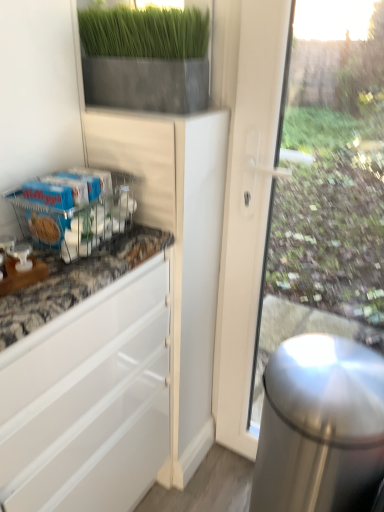
Question: Does metallic wire rack at lower left appear on the right side of polished stainless steel trash can at right?

Choices:
 (A) yes
 (B) no

Answer: (B)

Question: Could you tell me if metallic wire rack at lower left is facing polished stainless steel trash can at right?

Choices:
 (A) no
 (B) yes

Answer: (A)

Question: Is polished stainless steel trash can at right a part of metallic wire rack at lower left?

Choices:
 (A) yes
 (B) no

Answer: (B)

Question: Is metallic wire rack at lower left at the left side of polished stainless steel trash can at right?

Choices:
 (A) yes
 (B) no

Answer: (A)

Question: From the image's perspective, does metallic wire rack at lower left appear higher than polished stainless steel trash can at right?

Choices:
 (A) no
 (B) yes

Answer: (B)

Question: Is metallic wire rack at lower left bigger or smaller than matte gray planter at upper center?

Choices:
 (A) big
 (B) small

Answer: (B)

Question: Is point coord(49,247) positioned closer to the camera than point coord(109,34)?

Choices:
 (A) closer
 (B) farther

Answer: (A)

Question: From the image's perspective, is metallic wire rack at lower left located above or below matte gray planter at upper center?

Choices:
 (A) below
 (B) above

Answer: (A)

Question: Based on their positions, is metallic wire rack at lower left located to the left or right of matte gray planter at upper center?

Choices:
 (A) left
 (B) right

Answer: (A)

Question: Which is correct: polished stainless steel trash can at right is inside matte gray planter at upper center, or outside of it?

Choices:
 (A) inside
 (B) outside

Answer: (B)

Question: Relative to matte gray planter at upper center, is polished stainless steel trash can at right in front or behind?

Choices:
 (A) behind
 (B) front

Answer: (B)

Question: Would you say polished stainless steel trash can at right is to the left or to the right of matte gray planter at upper center in the picture?

Choices:
 (A) right
 (B) left

Answer: (A)

Question: Is polished stainless steel trash can at right bigger or smaller than matte gray planter at upper center?

Choices:
 (A) big
 (B) small

Answer: (A)

Question: From the image's perspective, relative to metallic wire rack at lower left, is polished stainless steel trash can at right above or below?

Choices:
 (A) above
 (B) below

Answer: (B)

Question: Is point (292, 452) positioned closer to the camera than point (89, 172)?

Choices:
 (A) closer
 (B) farther

Answer: (A)